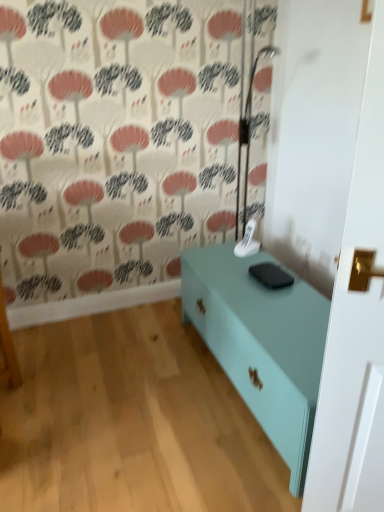
Measure the distance between mint green wood table at center and camera.

mint green wood table at center and camera are 3.92 feet apart.

The image size is (384, 512). Describe the element at coordinates (261, 343) in the screenshot. I see `mint green wood table at center` at that location.

Image resolution: width=384 pixels, height=512 pixels. Identify the location of mint green wood table at center. (261, 343).

Find the location of a particular element. mint green wood table at center is located at coordinates (261, 343).